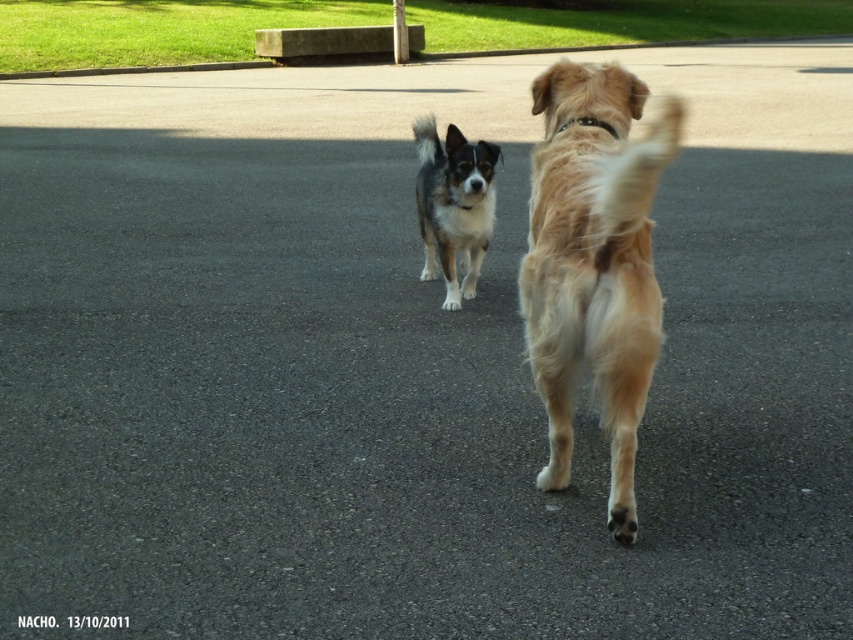
You are a photographer trying to capture both the golden fur dog at center and the black and white fur at center in a single frame. Given that your camera can only focus on objects within a 1.5 meter width, will both dogs fit comfortably within the frame?

The golden fur dog at center is wider than the black and white fur at center. Since the camera can focus on objects within a 1.5 meter width, both dogs might fit if their combined width is less than 1.5 meters. However, since the golden fur dog is larger, it depends on their exact positions and total width.

You are a photographer trying to capture both dogs in the scene. Given that the golden fur dog at center is larger than the black and white fur at center, which dog should you focus on to ensure both are in frame without zooming in or out?

To ensure both the golden fur dog at center and the black and white fur at center are in frame without zooming, focus on the golden fur dog at center since it is larger and will be more visible while the smaller black and white fur at center will also fit in the frame.